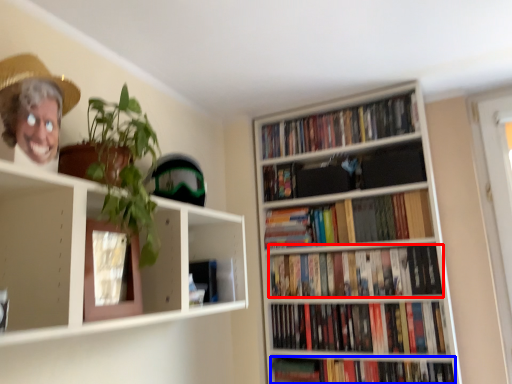
Question: Among these objects, which one is nearest to the camera, book (highlighted by a red box) or book (highlighted by a blue box)?

Choices:
 (A) book
 (B) book

Answer: (B)